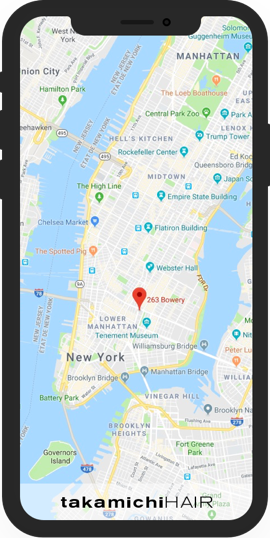
I want to click on speaker, so click(139, 22).